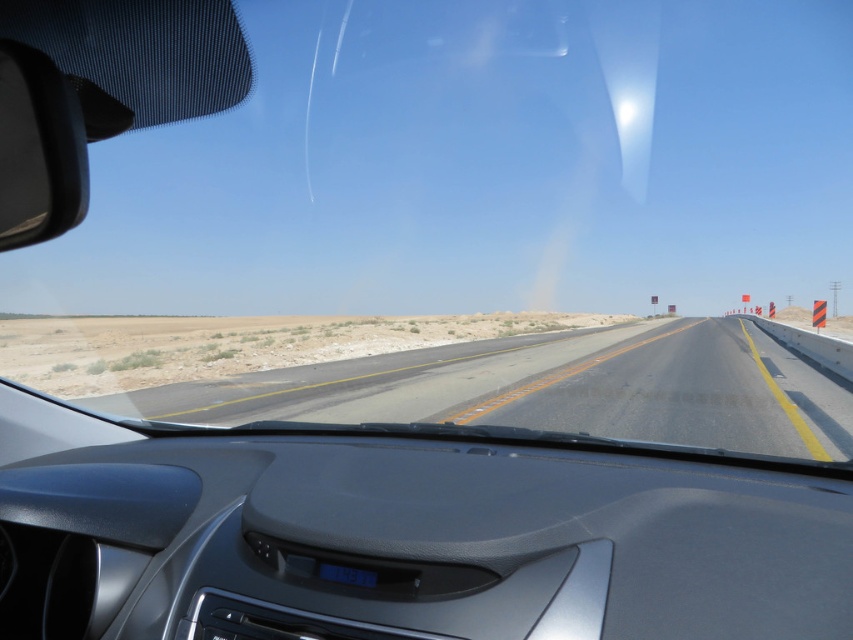
Between asphalt road at center and black glossy view mirror at left, which one appears on the right side from the viewer's perspective?

asphalt road at center is more to the right.

Where is `asphalt road at center`? Image resolution: width=853 pixels, height=640 pixels. asphalt road at center is located at coordinates (552, 388).